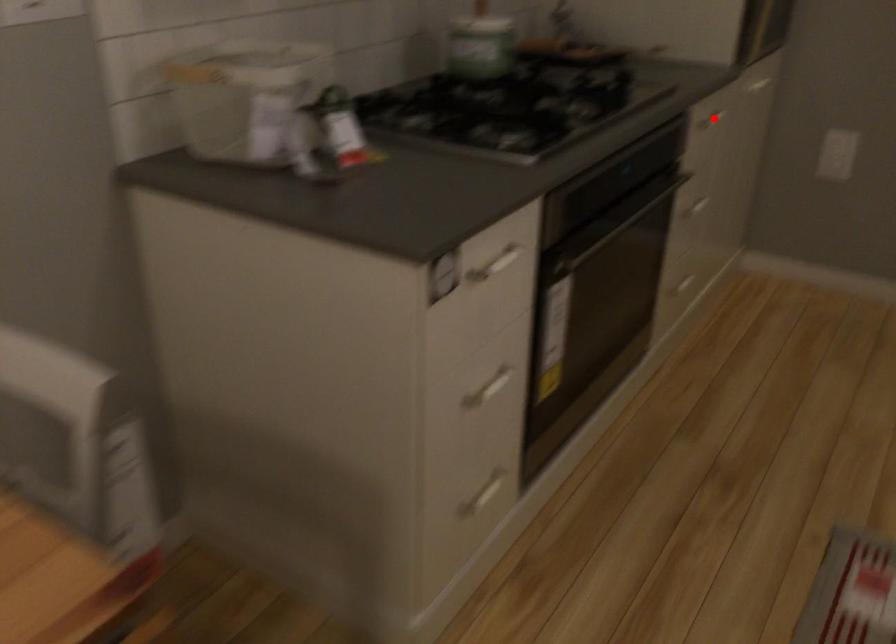
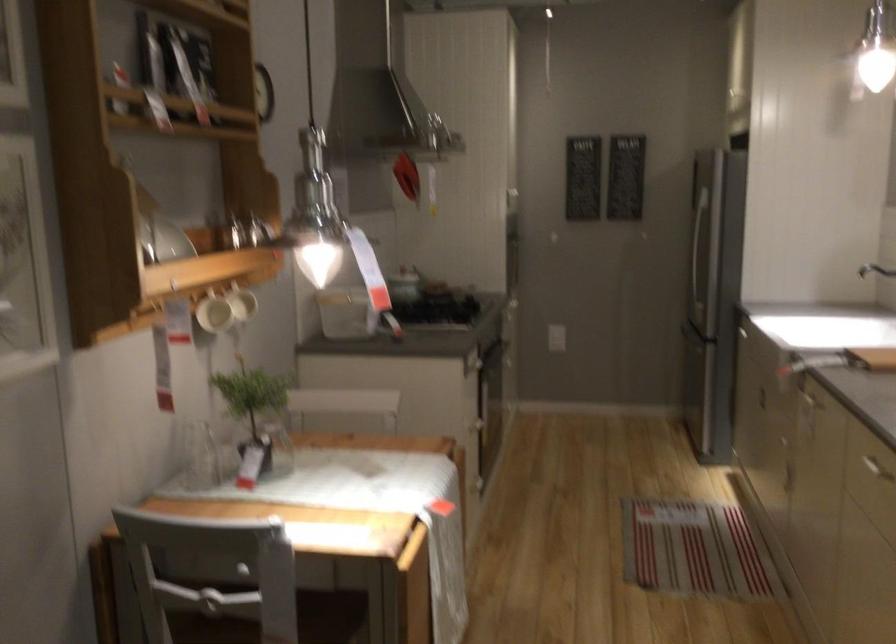
Question: I am providing you with two images of the same scene from different viewpoints. A red point is marked on the first image. Is the red point's position out of view in image 2?

Choices:
 (A) Yes
 (B) No

Answer: (A)